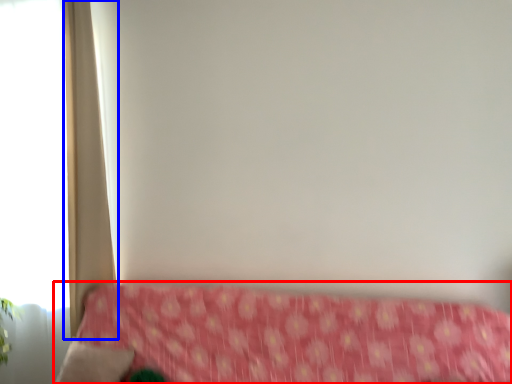
Question: Which of the following is the closest to the observer, furniture (highlighted by a red box) or curtain (highlighted by a blue box)?

Choices:
 (A) furniture
 (B) curtain

Answer: (A)